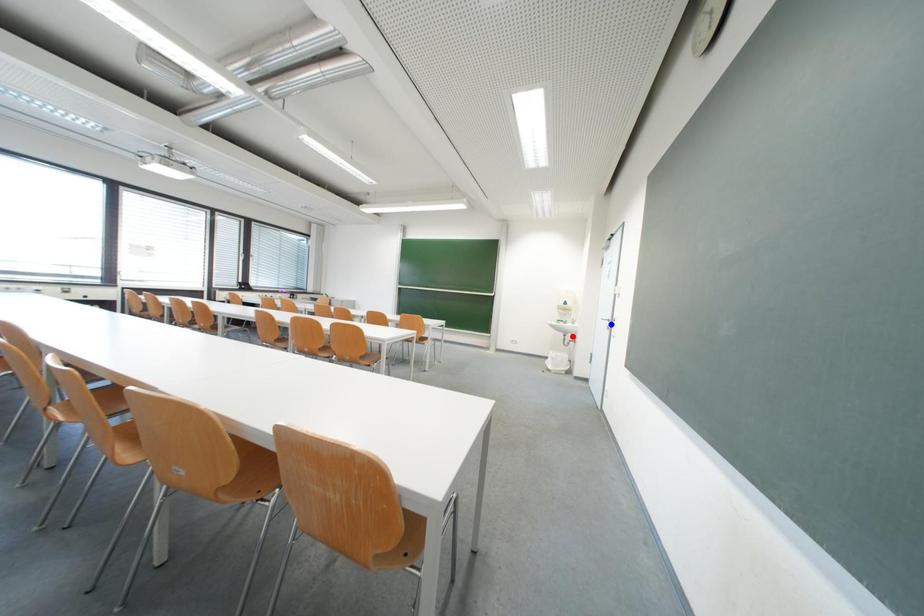
Question: Which of the two points in the image is closer to the camera?

Choices:
 (A) Blue point is closer.
 (B) Red point is closer.

Answer: (A)